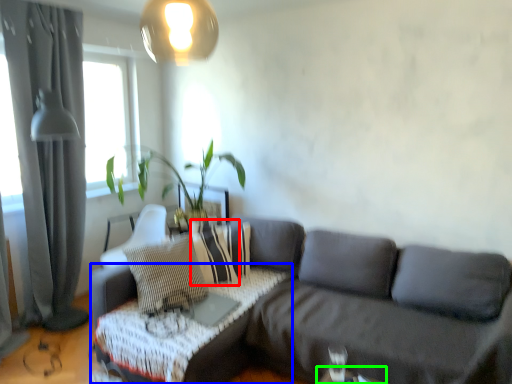
Question: Based on their relative distances, which object is nearer to pillow (highlighted by a red box)? Choose from table (highlighted by a blue box) and table (highlighted by a green box).

Choices:
 (A) table
 (B) table

Answer: (A)